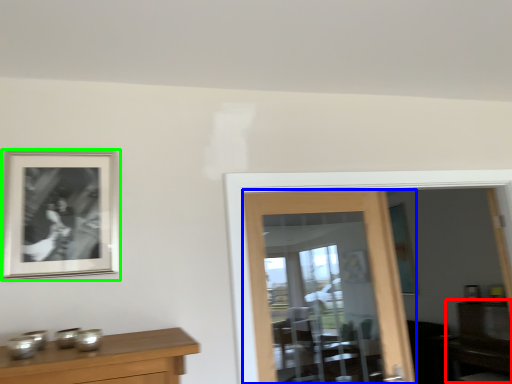
Question: Based on their relative distances, which object is nearer to dresser (highlighted by a red box)? Choose from door (highlighted by a blue box) and picture frame (highlighted by a green box).

Choices:
 (A) door
 (B) picture frame

Answer: (A)